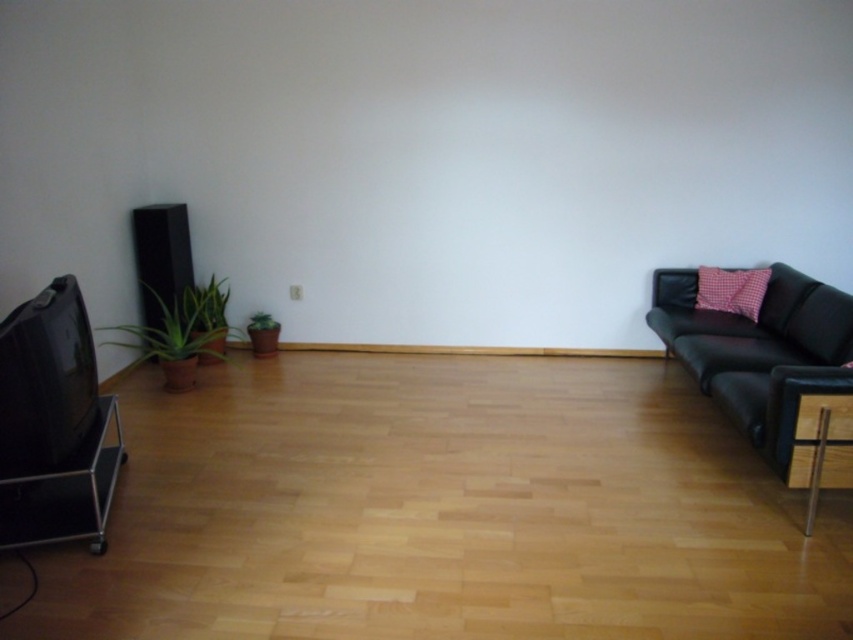
You are arranging a living room and want to place a new sofa between the green matte plant at left and the green matte plant at lower left. Based on their positions, which plant should the sofa be closer to?

The green matte plant at left is below the green matte plant at lower left, so the sofa should be placed closer to the green matte plant at lower left to maintain balance between the two plants.

You are standing in the living room and want to determine the relative positions of two points marked in the scene. Which point, point 1 at coordinates point [675,316] or point 2 at coordinates point [169,353], is closer to you?

Point 1 at coordinates point [675,316] is closer to you because it is further to the viewer than point 2 at coordinates point [169,353].

You are planning to place a new rectangular coffee table in the middle of the living room. The coffee table is 1.2 meters wide. Considering the black leather couch at right and the green matte plant at left, which object has a greater width and can you confirm if the coffee table will fit between them?

The black leather couch at right has a greater width than the green matte plant at left. Since the black leather couch at right is wider than the green matte plant at left, the coffee table measuring 1.2 meters may fit between them, but the exact fit depends on the actual widths of both objects. However, based on the given information, the couch is wider, so there might be sufficient space.